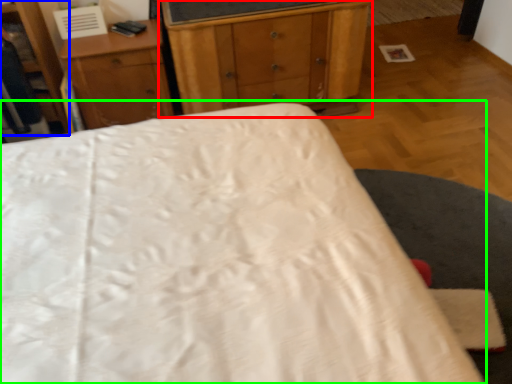
Question: Estimate the real-world distances between objects in this image. Which object is farther from chest of drawers (highlighted by a red box), dresser (highlighted by a blue box) or bed (highlighted by a green box)?

Choices:
 (A) dresser
 (B) bed

Answer: (B)